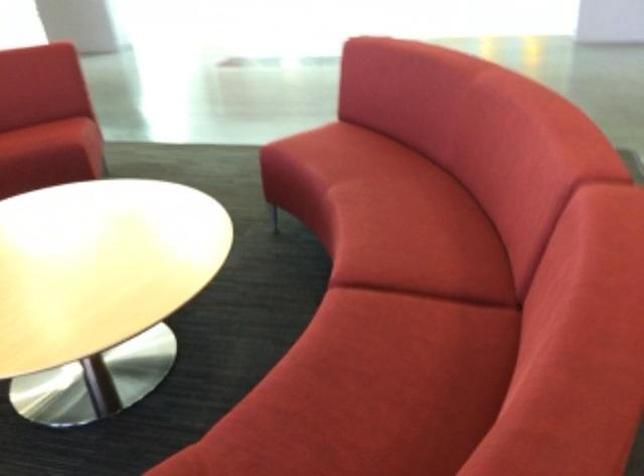
Describe the element at coordinates (46, 136) in the screenshot. The height and width of the screenshot is (476, 644). I see `the red chair sitting surface` at that location.